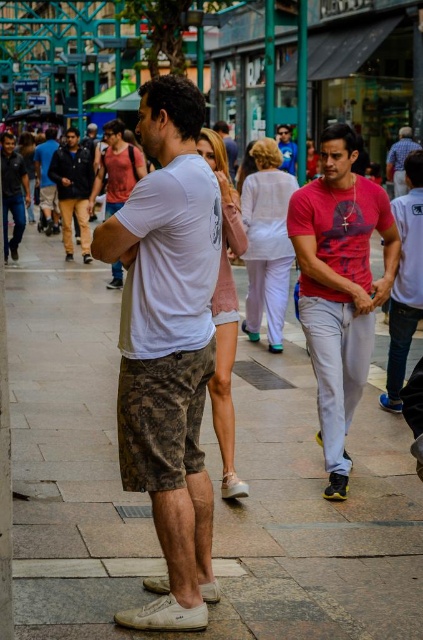
Question: Which point is closer to the camera?

Choices:
 (A) (57, 156)
 (B) (227, 608)
 (C) (187, 336)

Answer: (C)

Question: Which object is the farthest from the white matte t-shirt at center?

Choices:
 (A) matte pink t-shirt at center
 (B) blue plaid shirt at upper right

Answer: (B)

Question: Estimate the real-world distances between objects in this image. Which object is closer to the blue plaid shirt at upper right?

Choices:
 (A) dark brown leather jacket at left
 (B) white matte t-shirt at center
 (C) matte pink shirt at center
 (D) matte pink t-shirt at center

Answer: (A)

Question: From the image, what is the correct spatial relationship of matte pink t-shirt at center in relation to matte pink shirt at center?

Choices:
 (A) above
 (B) below

Answer: (B)

Question: Can you confirm if gray stone pavement at center is positioned below blue plaid shirt at upper right?

Choices:
 (A) yes
 (B) no

Answer: (A)

Question: Does gray stone pavement at center have a lesser width compared to blue denim jeans at center?

Choices:
 (A) no
 (B) yes

Answer: (A)